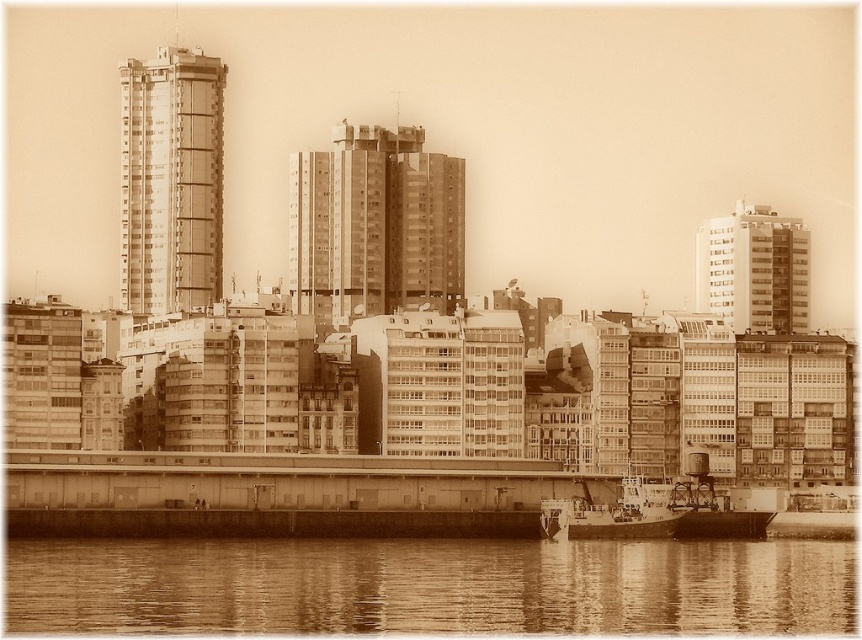
You are an urban planner analyzing the waterfront area. You observe the smooth concrete building at left and the smooth concrete building at right. Which building has a greater horizontal extent when viewed from the shore?

The smooth concrete building at left has a greater horizontal extent than the smooth concrete building at right because its width surpasses the other.